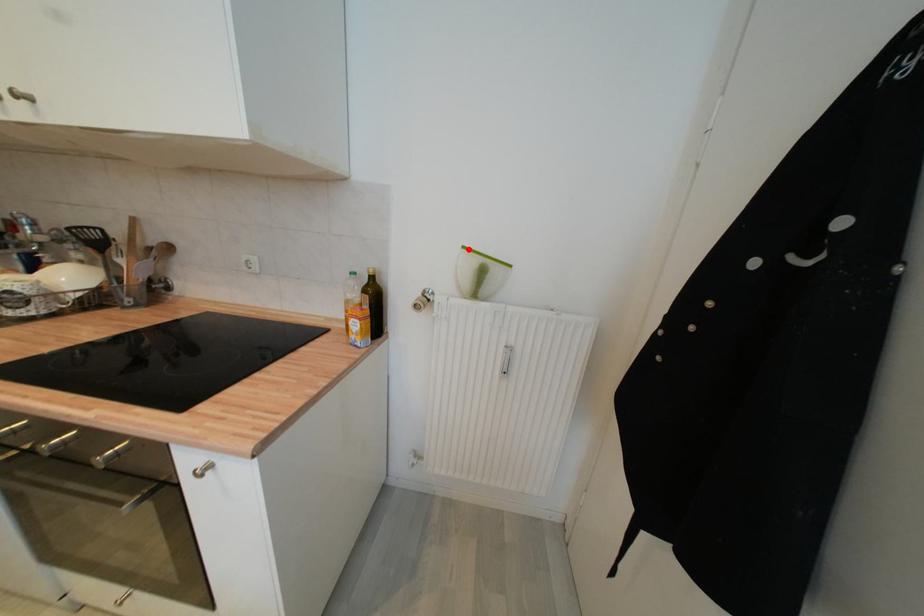
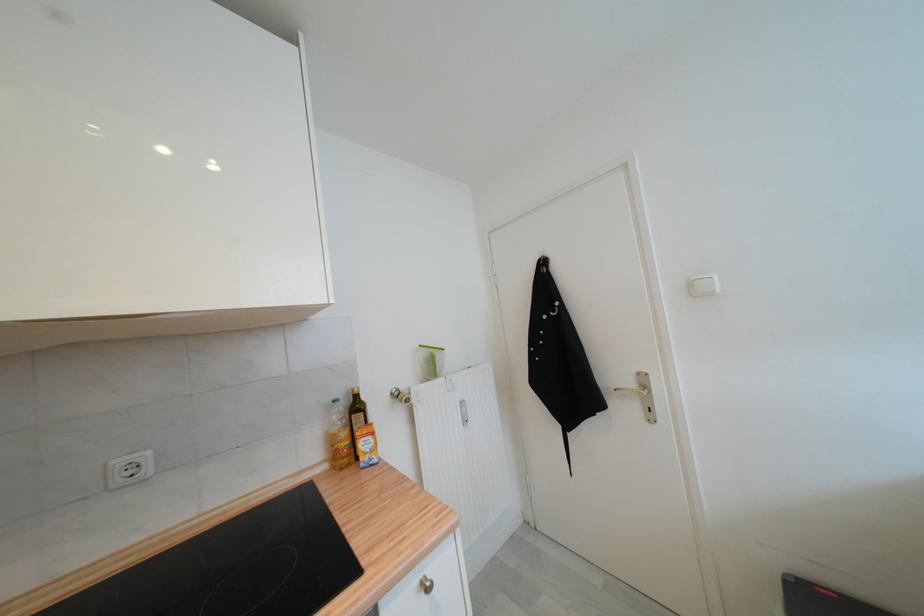
Locate, in the second image, the point that corresponds to the highlighted location in the first image.

(426, 347)